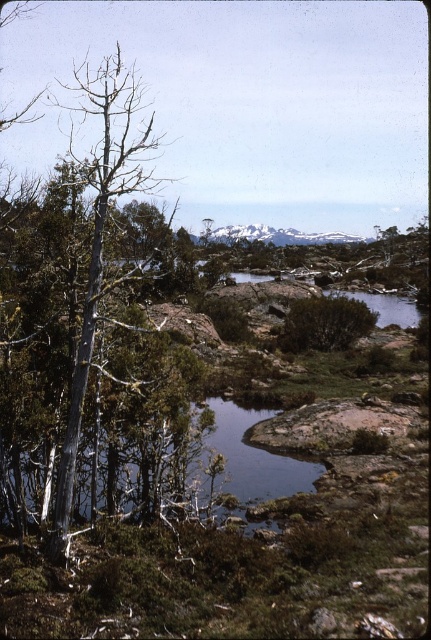
Question: Which point is farther to the camera?

Choices:
 (A) snowy rock at center
 (B) silver bark tree at left

Answer: (A)

Question: Based on their relative distances, which object is nearer to the green leafy bush at center?

Choices:
 (A) snowy rock at center
 (B) silver bark tree at left

Answer: (B)

Question: Can you confirm if silver bark tree at left is wider than snowy rock at center?

Choices:
 (A) no
 (B) yes

Answer: (A)

Question: Does silver bark tree at left appear on the right side of snowy rock at center?

Choices:
 (A) no
 (B) yes

Answer: (A)

Question: Which object is the closest to the green leafy bush at center?

Choices:
 (A) snowy rock at center
 (B) silver bark tree at left

Answer: (B)

Question: Is silver bark tree at left below snowy rock at center?

Choices:
 (A) no
 (B) yes

Answer: (A)